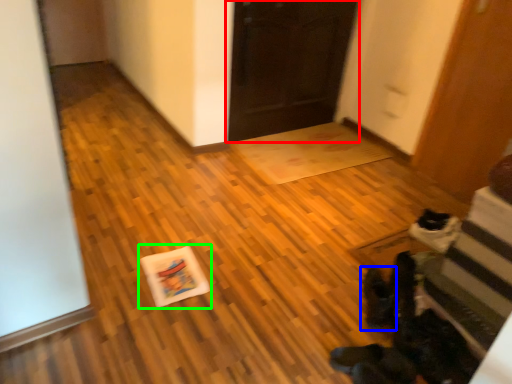
Question: Which object is the closest to the door (highlighted by a red box)? Choose among these: footwear (highlighted by a blue box) or postcard (highlighted by a green box).

Choices:
 (A) footwear
 (B) postcard

Answer: (B)